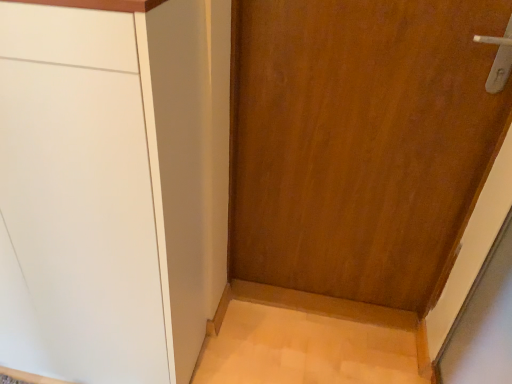
Image resolution: width=512 pixels, height=384 pixels. In order to click on vacant space situated on the left part of wooden door at center in this screenshot , I will do `click(255, 324)`.